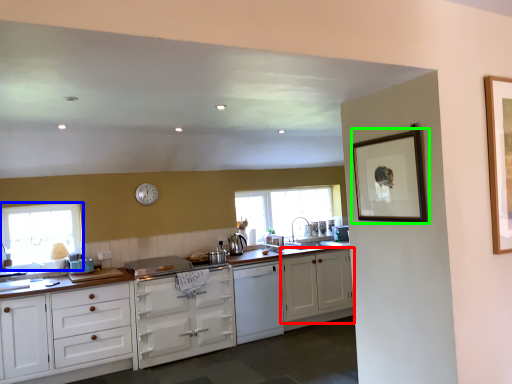
Question: Based on their relative distances, which object is farther from cabinetry (highlighted by a red box)? Choose from window (highlighted by a blue box) and picture frame (highlighted by a green box).

Choices:
 (A) window
 (B) picture frame

Answer: (A)